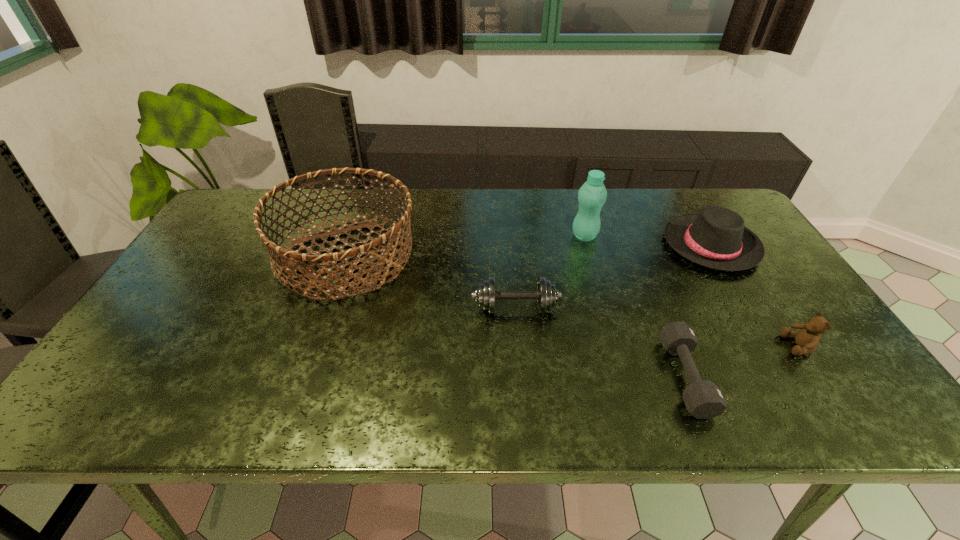
Locate an element on the screen. vacant space situated on the left of the bottle is located at coordinates (539, 236).

Locate an element on the screen. The height and width of the screenshot is (540, 960). free space located on the back of the leftmost object is located at coordinates (366, 200).

I want to click on vacant space located on the front of the dress hat, so click(x=770, y=342).

You are a GUI agent. You are given a task and a screenshot of the screen. Output one action in this format:
    pyautogui.click(x=<x>, y=<y>)
    Task: Click on the vacant space positioned 0.080m on the front-facing side of the teddy bear
    
    Given the screenshot: What is the action you would take?
    pyautogui.click(x=751, y=346)

This screenshot has height=540, width=960. In order to click on vacant space located 0.130m on the front-facing side of the teddy bear in this screenshot , I will do `click(730, 346)`.

Where is `vacant area situated 0.350m on the front-facing side of the teddy bear`? The width and height of the screenshot is (960, 540). vacant area situated 0.350m on the front-facing side of the teddy bear is located at coordinates (636, 346).

Locate an element on the screen. This screenshot has height=540, width=960. vacant area situated on the front of the left dumbbell is located at coordinates (520, 368).

At what (x,y) coordinates should I click in order to perform the action: click on vacant area located on the right of the shortest object. Please return your answer as a coordinate pair (x, y). This screenshot has height=540, width=960. Looking at the image, I should click on [x=773, y=377].

The image size is (960, 540). Find the location of `bottle at the far edge`. bottle at the far edge is located at coordinates (592, 195).

At what (x,y) coordinates should I click in order to perform the action: click on basket that is positioned at the far edge. Please return your answer as a coordinate pair (x, y). The width and height of the screenshot is (960, 540). Looking at the image, I should click on (288, 256).